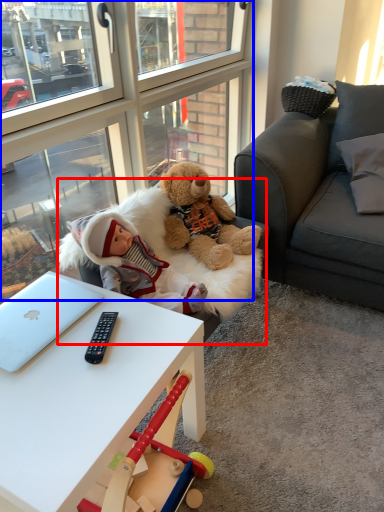
Question: Among these objects, which one is nearest to the camera, swivel chair (highlighted by a red box) or glass door (highlighted by a blue box)?

Choices:
 (A) swivel chair
 (B) glass door

Answer: (B)